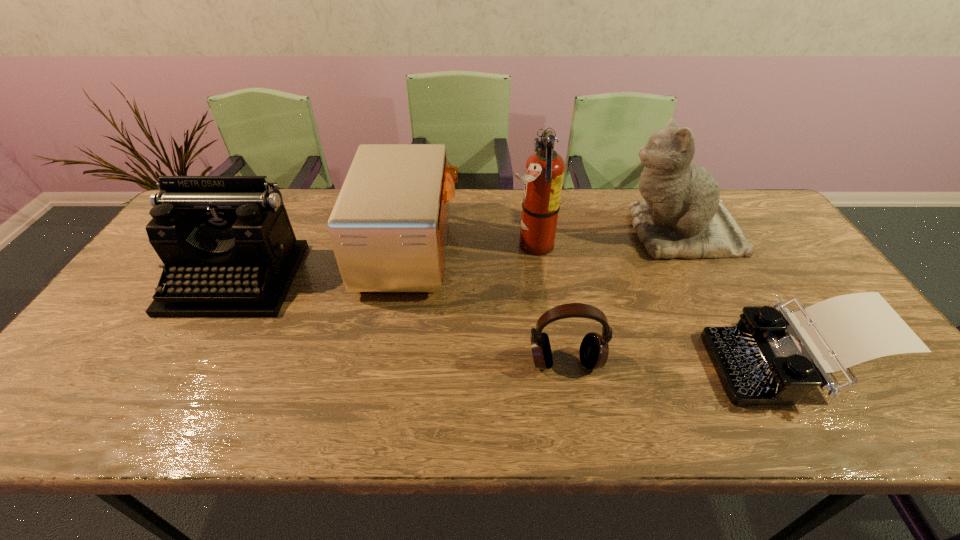
Find the location of a particular element. The image size is (960, 540). object that is the third closest to the second object from left to right is located at coordinates (594, 349).

Identify the location of object that is the fifth closest to the right typewriter. (229, 250).

The height and width of the screenshot is (540, 960). In order to click on vacant point that satisfies the following two spatial constraints: 1. on the door side of the fifth object from right to left; 2. on the typing side of the leftmost object in this screenshot , I will do `click(406, 279)`.

What are the coordinates of `free spot that satisfies the following two spatial constraints: 1. on the door side of the toaster oven; 2. on the typing side of the leftmost object` in the screenshot? It's located at (406, 279).

Locate an element on the screen. vacant space that satisfies the following two spatial constraints: 1. from the nozzle of the fire extinguisher; 2. on the typing side of the farther typewriter is located at coordinates (536, 279).

What are the coordinates of `vacant space that satisfies the following two spatial constraints: 1. on the front-facing side of the cat; 2. on the typing side of the leftmost object` in the screenshot? It's located at (702, 279).

Identify the location of vacant region that satisfies the following two spatial constraints: 1. on the door side of the toaster oven; 2. on the typing side of the left typewriter. This screenshot has height=540, width=960. (406, 279).